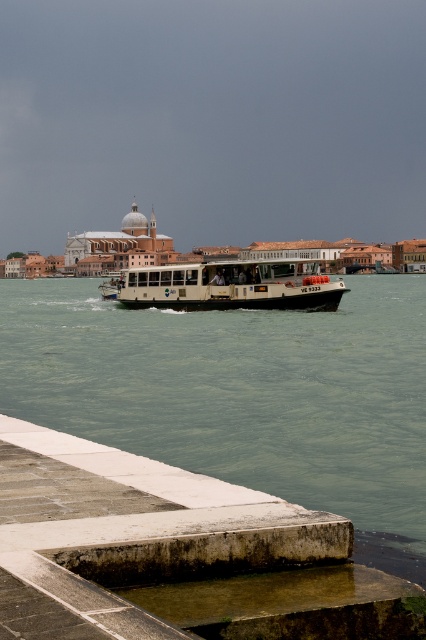
You are standing on the concrete dock at lower left and want to reach the clear water at center. Which direction should you move to get there?

You should move to the right because the clear water at center is to the left of concrete dock at lower left, so moving right from the dock would lead towards the water.

You are a delivery person needing to unload a package onto the concrete dock at lower left from the white matte boat at center. Considering their widths, will the package fit entirely on the dock?

The concrete dock at lower left has a lesser width compared to the white matte boat at center, so the package may not fit entirely on the dock if it is as wide as the boat.